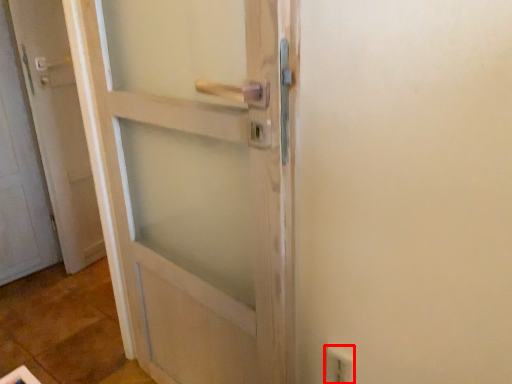
Question: From the image's perspective, where is electric outlet (annotated by the red box) located relative to door?

Choices:
 (A) above
 (B) below

Answer: (B)